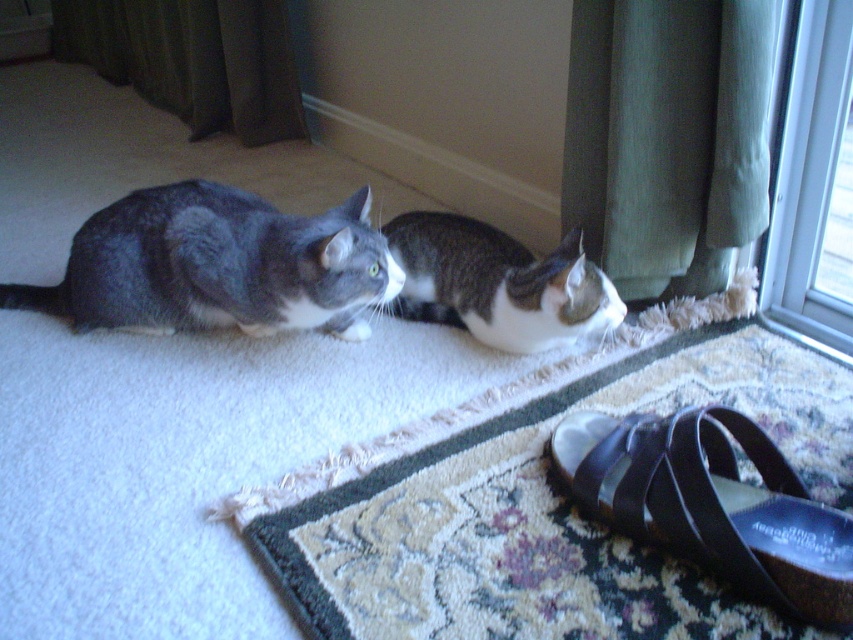
Consider the image. Which is below, gray fur cat at left or transparent glass door at upper right?

gray fur cat at left is below.

Where is `gray fur cat at left`? gray fur cat at left is located at coordinates (218, 266).

Who is positioned more to the left, green fabric curtain at upper right or green fabric curtain at upper left?

From the viewer's perspective, green fabric curtain at upper left appears more on the left side.

Between point (704, 144) and point (291, 64), which one is positioned behind?

Positioned behind is point (291, 64).

This screenshot has height=640, width=853. I want to click on green fabric curtain at upper right, so click(666, 134).

Does green fabric curtain at upper left have a lesser height compared to transparent glass door at upper right?

No.

Is point (265, 93) positioned behind point (807, 134)?

Yes, point (265, 93) is behind point (807, 134).

Image resolution: width=853 pixels, height=640 pixels. I want to click on green fabric curtain at upper left, so click(x=192, y=60).